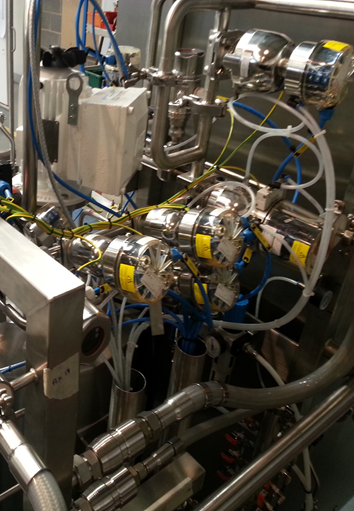
This screenshot has width=354, height=511. What are the coordinates of `white pipe` in the screenshot? It's located at (130, 345), (115, 351), (109, 364), (293, 312), (303, 143), (277, 131).